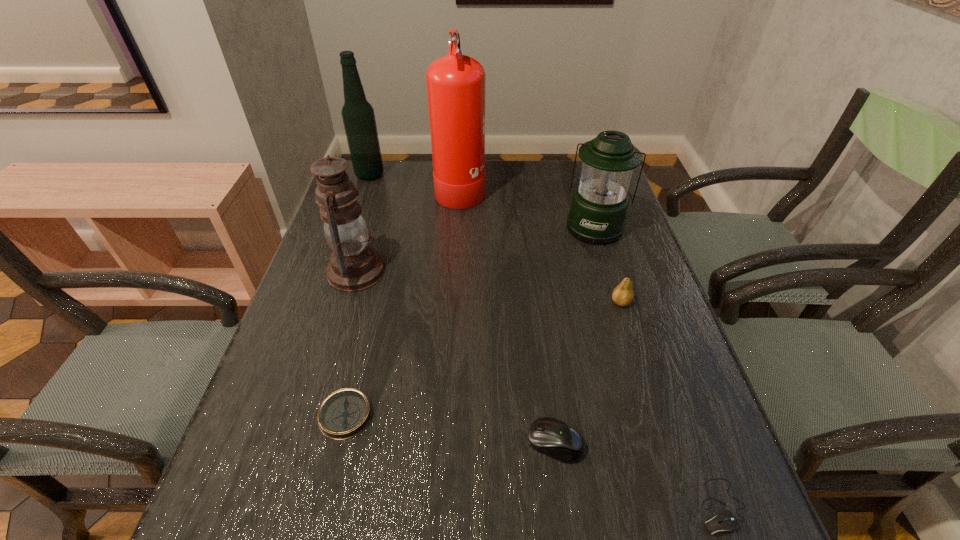
You are a GUI agent. You are given a task and a screenshot of the screen. Output one action in this format:
    pyautogui.click(x=<x>, y=<y>)
    Task: Click on the unoccupied area between the pear and the nearest object
    
    Given the screenshot: What is the action you would take?
    pos(671,404)

The width and height of the screenshot is (960, 540). Identify the location of free space between the third shortest object and the alcohol. (463, 309).

Locate an element on the screen. Image resolution: width=960 pixels, height=540 pixels. object that stands as the fourth closest to the fourth object from left to right is located at coordinates (623, 294).

Select which object is the seventh closest to the nearer computer mouse. Please provide its 2D coordinates. Your answer should be formatted as a tuple, i.e. [(x, y)], where the tuple contains the x and y coordinates of a point satisfying the conditions above.

[(358, 116)]

Find the location of a particular element. vacant area in the image that satisfies the following two spatial constraints: 1. on the front side of the oil lamp; 2. on the right side of the nearer computer mouse is located at coordinates (287, 507).